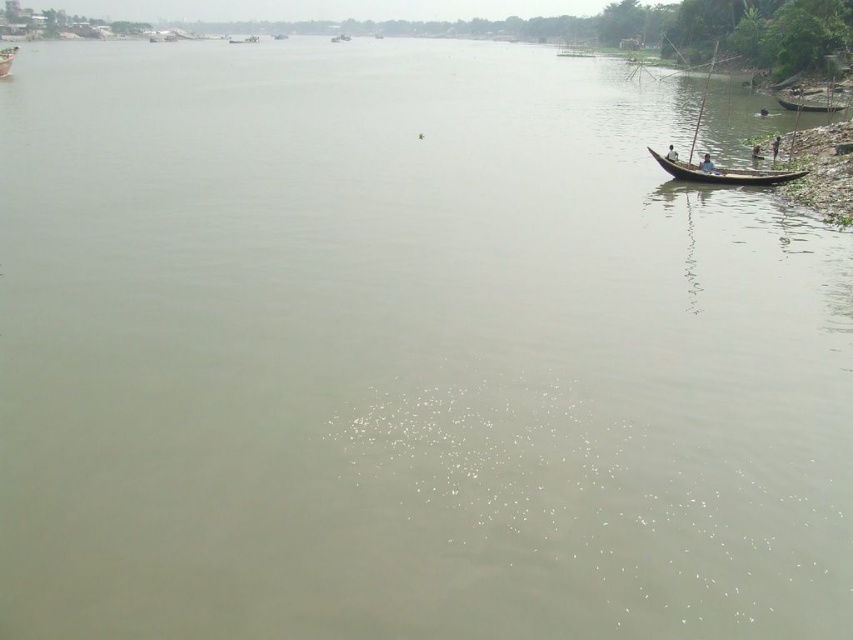
Question: Does light blue fabric boat at right appear on the right side of dark brown wooden boat at right?

Choices:
 (A) no
 (B) yes

Answer: (B)

Question: Is blue fabric person at right thinner than light blue fabric boat at right?

Choices:
 (A) yes
 (B) no

Answer: (A)

Question: Which point appears closest to the camera in this image?

Choices:
 (A) (674, 152)
 (B) (4, 58)
 (C) (693, 179)
 (D) (699, 104)

Answer: (C)

Question: Estimate the real-world distances between objects in this image. Which object is closer to the wooden boat at upper left?

Choices:
 (A) light blue fabric boat at right
 (B) blue fabric person at right
 (C) wooden canoe at right

Answer: (C)

Question: Considering the real-world distances, which object is farthest from the wooden boat at upper left?

Choices:
 (A) wooden paddle at right
 (B) light blue fabric boat at right

Answer: (A)

Question: Does wooden paddle at right appear under blue fabric person at right?

Choices:
 (A) yes
 (B) no

Answer: (B)